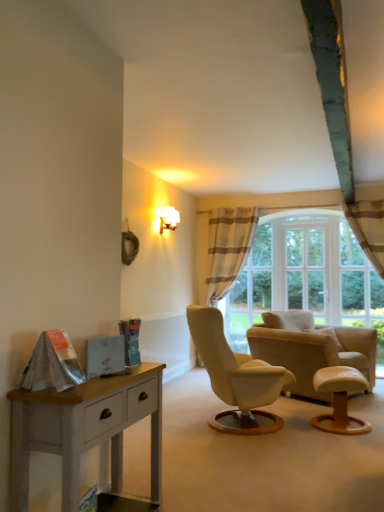
Question: From the image's perspective, relative to white painted wood nightstand at lower left, is light brown wooden stool at lower right above or below?

Choices:
 (A) above
 (B) below

Answer: (B)

Question: Is light brown wooden stool at lower right inside the boundaries of white painted wood nightstand at lower left, or outside?

Choices:
 (A) outside
 (B) inside

Answer: (A)

Question: Based on their relative distances, which object is nearer to the white glossy wall sconce at upper right?

Choices:
 (A) light brown wooden stool at lower right
 (B) white ribbed radiator at center
 (C) white glass window at center
 (D) beige leather chair at center
 (E) white painted wood nightstand at lower left

Answer: (B)

Question: Which is farther from the striped fabric curtain at center?

Choices:
 (A) light brown wooden stool at lower right
 (B) beige leather chair at center
 (C) white glossy wall sconce at upper right
 (D) white ribbed radiator at center
 (E) white painted wood nightstand at lower left

Answer: (E)